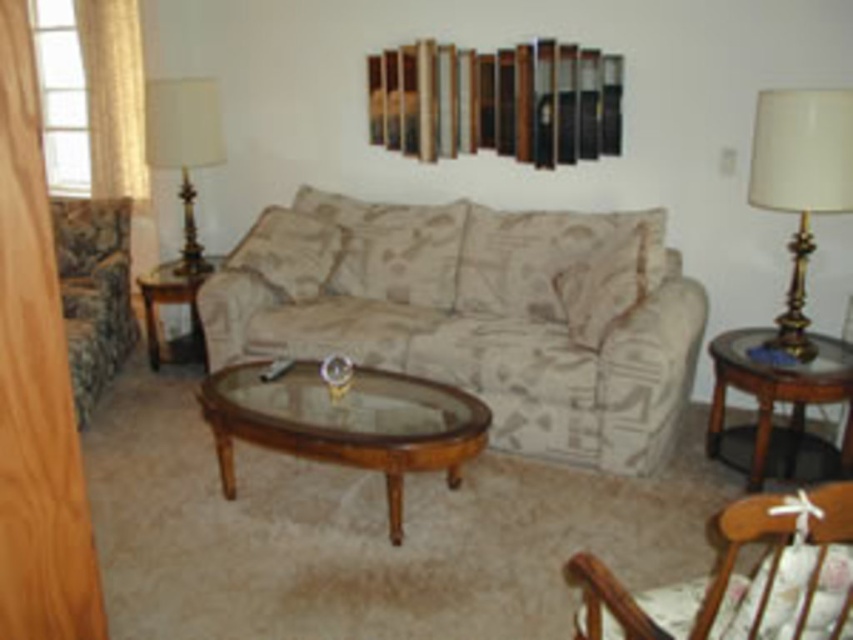
Question: Does transparent wood glass table at center appear over matte gold lamp at left?

Choices:
 (A) yes
 (B) no

Answer: (B)

Question: Which object is closer to the camera taking this photo?

Choices:
 (A) beige fabric couch at center
 (B) camouflage fabric couch at left

Answer: (A)

Question: Does beige fabric couch at center have a smaller size compared to camouflage fabric couch at left?

Choices:
 (A) yes
 (B) no

Answer: (B)

Question: Which is nearer to the wooden rocking chair at lower right?

Choices:
 (A) gold metallic table lamp at right
 (B) transparent wood glass table at center
 (C) matte gold lamp at left
 (D) camouflage fabric couch at left

Answer: (B)

Question: Considering the relative positions of beige fabric couch at center and gold metallic table lamp at right in the image provided, where is beige fabric couch at center located with respect to gold metallic table lamp at right?

Choices:
 (A) left
 (B) right

Answer: (A)

Question: Which of these objects is positioned farthest from the wooden rocking chair at lower right?

Choices:
 (A) transparent wood glass table at center
 (B) brown wood side table at right
 (C) matte gold lamp at left
 (D) camouflage fabric couch at left

Answer: (C)